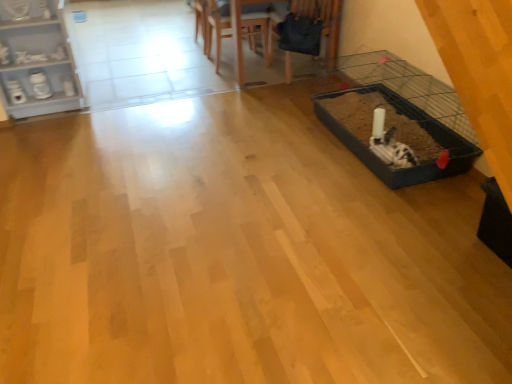
Question: Should I look upward or downward to see wooden chair at upper center, which is the 2th armchair in right-to-left order?

Choices:
 (A) up
 (B) down

Answer: (A)

Question: Can you confirm if wooden table at upper center is wider than white painted wood shelf at upper left?

Choices:
 (A) yes
 (B) no

Answer: (A)

Question: Does wooden table at upper center have a smaller size compared to white painted wood shelf at upper left?

Choices:
 (A) yes
 (B) no

Answer: (B)

Question: Is wooden table at upper center outside of white painted wood shelf at upper left?

Choices:
 (A) yes
 (B) no

Answer: (A)

Question: Considering the relative positions of wooden table at upper center and white painted wood shelf at upper left in the image provided, is wooden table at upper center to the right of white painted wood shelf at upper left from the viewer's perspective?

Choices:
 (A) yes
 (B) no

Answer: (A)

Question: From the image's perspective, is wooden table at upper center under white painted wood shelf at upper left?

Choices:
 (A) yes
 (B) no

Answer: (B)

Question: Is wooden table at upper center further to camera compared to white painted wood shelf at upper left?

Choices:
 (A) no
 (B) yes

Answer: (B)

Question: From the image's perspective, does velvet dark blue armchair at upper center, acting as the first armchair starting from the right, appear lower than wooden chair at upper center, positioned as the first armchair in left-to-right order?

Choices:
 (A) no
 (B) yes

Answer: (B)

Question: Are velvet dark blue armchair at upper center, acting as the first armchair starting from the right, and wooden chair at upper center, positioned as the first armchair in left-to-right order, located far from each other?

Choices:
 (A) yes
 (B) no

Answer: (B)

Question: Does velvet dark blue armchair at upper center, which ranks as the third armchair in left-to-right order, come in front of wooden chair at upper center, positioned as the 3th armchair in right-to-left order?

Choices:
 (A) yes
 (B) no

Answer: (A)

Question: Can you confirm if velvet dark blue armchair at upper center, acting as the first armchair starting from the right, is bigger than wooden chair at upper center, positioned as the first armchair in left-to-right order?

Choices:
 (A) no
 (B) yes

Answer: (B)

Question: Could you tell me if velvet dark blue armchair at upper center, which ranks as the third armchair in left-to-right order, is turned towards wooden chair at upper center, positioned as the 3th armchair in right-to-left order?

Choices:
 (A) no
 (B) yes

Answer: (A)

Question: From a real-world perspective, is velvet dark blue armchair at upper center, which ranks as the third armchair in left-to-right order, on top of wooden chair at upper center, positioned as the first armchair in left-to-right order?

Choices:
 (A) yes
 (B) no

Answer: (A)

Question: Can you confirm if wooden chair at upper center, positioned as the 3th armchair in right-to-left order, is smaller than wooden chair at upper center, which ranks as the 2th armchair in left-to-right order?

Choices:
 (A) yes
 (B) no

Answer: (A)